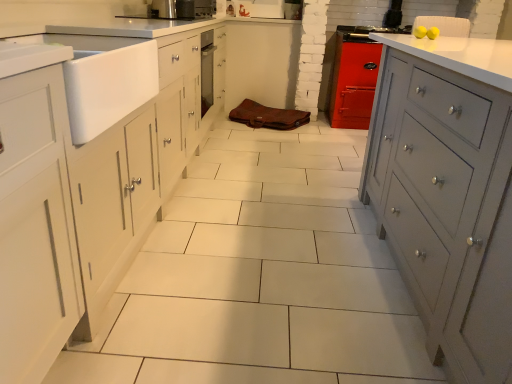
Question: Visually, is matte gray cabinet at right positioned to the left or to the right of metallic stainless steel oven at center?

Choices:
 (A) left
 (B) right

Answer: (B)

Question: From a real-world perspective, relative to metallic stainless steel oven at center, is matte gray cabinet at right vertically above or below?

Choices:
 (A) below
 (B) above

Answer: (A)

Question: Which object is positioned farthest from the white matte sink at left?

Choices:
 (A) matte gray cabinet at right
 (B) metallic stainless steel oven at center

Answer: (A)

Question: Based on their relative distances, which object is farther from the matte gray cabinet at right?

Choices:
 (A) white matte sink at left
 (B) metallic stainless steel oven at center

Answer: (B)